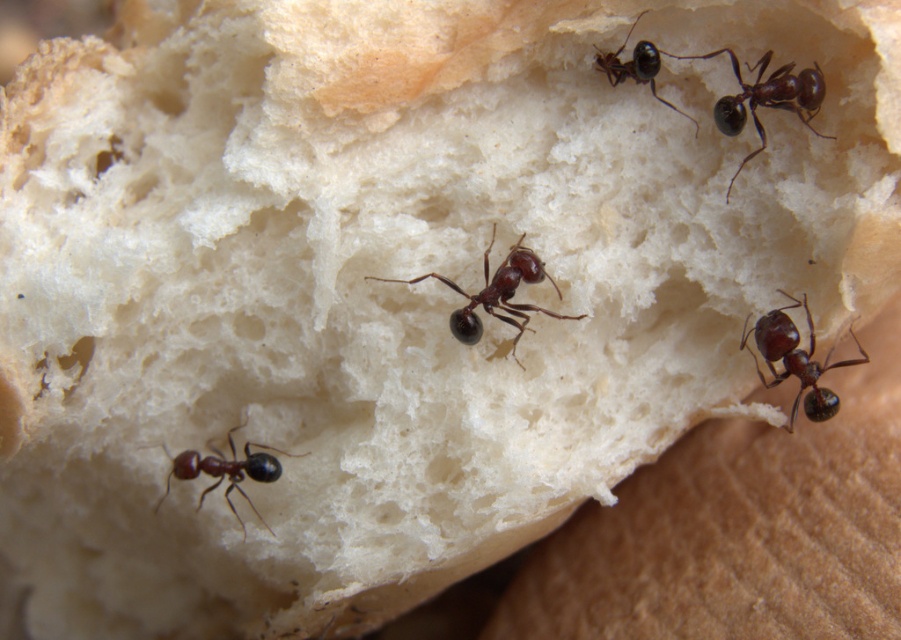
Does shiny dark brown ant at center have a lesser width compared to shiny dark brown ant at upper center?

In fact, shiny dark brown ant at center might be wider than shiny dark brown ant at upper center.

Where is `shiny dark brown ant at center`? This screenshot has width=901, height=640. shiny dark brown ant at center is located at coordinates (496, 292).

Does shiny dark brown ant at center appear on the left side of shiny black ant at lower left?

In fact, shiny dark brown ant at center is to the right of shiny black ant at lower left.

Which is in front, point (499, 301) or point (274, 448)?

Point (499, 301)

Find the location of a particular element. shiny dark brown ant at center is located at coordinates (496, 292).

Can you confirm if shiny brown ant at center-right is bigger than shiny dark brown ant at center?

Yes.

Which is behind, point (781, 332) or point (521, 276)?

The point (521, 276) is more distant.

Does point (834, 346) come in front of point (493, 316)?

No, (834, 346) is behind (493, 316).

Image resolution: width=901 pixels, height=640 pixels. Find the location of `shiny brown ant at center-right`. shiny brown ant at center-right is located at coordinates (795, 358).